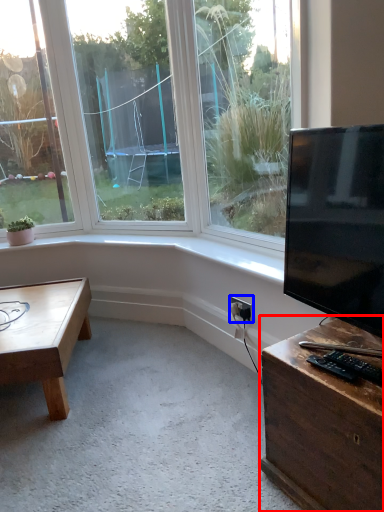
Question: Which object appears closest to the camera in this image, desk (highlighted by a red box) or electric outlet (highlighted by a blue box)?

Choices:
 (A) desk
 (B) electric outlet

Answer: (A)